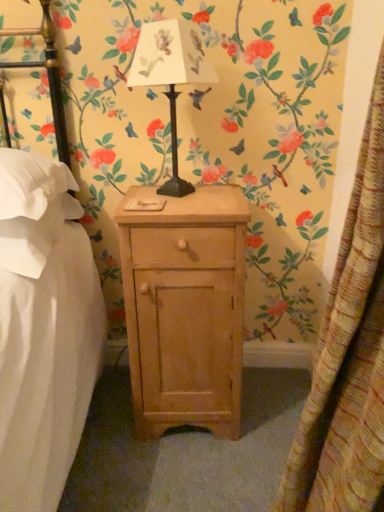
Identify the location of vacant space to the right of light wood nightstand at center. This screenshot has height=512, width=384. (268, 408).